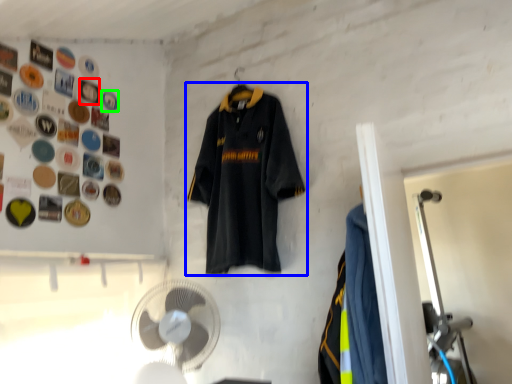
Question: Considering the real-world distances, which object is closest to button (highlighted by a red box)? sports uniform (highlighted by a blue box) or button (highlighted by a green box).

Choices:
 (A) sports uniform
 (B) button

Answer: (B)